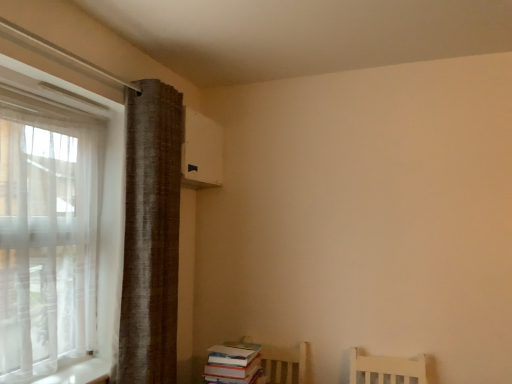
Image resolution: width=512 pixels, height=384 pixels. What are the coordinates of `brown textured curtain at left` in the screenshot? It's located at tap(150, 236).

This screenshot has height=384, width=512. What do you see at coordinates (150, 236) in the screenshot?
I see `brown textured curtain at left` at bounding box center [150, 236].

In order to face brown textured curtain at left, should I rotate leftwards or rightwards?

Rotate your view left by about 13.163°.

Image resolution: width=512 pixels, height=384 pixels. What do you see at coordinates (232, 363) in the screenshot?
I see `hardcover books at lower right` at bounding box center [232, 363].

The image size is (512, 384). Find the location of `hardcover books at lower right`. hardcover books at lower right is located at coordinates (232, 363).

Measure the distance between point (244, 363) and camera.

Point (244, 363) and camera are 1.90 meters apart.

I want to click on brown textured curtain at left, so click(150, 236).

Is brown textured curtain at left to the left of hardcover books at lower right from the viewer's perspective?

Yes, brown textured curtain at left is to the left of hardcover books at lower right.

Which object is further away from the camera taking this photo, brown textured curtain at left or hardcover books at lower right?

hardcover books at lower right.

Which point is more distant from viewer, [172,325] or [215,367]?

Positioned behind is point [172,325].

Looking at this image, from the image's perspective, which is below, brown textured curtain at left or hardcover books at lower right?

hardcover books at lower right.

From a real-world perspective, is brown textured curtain at left positioned under hardcover books at lower right based on gravity?

Incorrect, from a real-world perspective, brown textured curtain at left is higher than hardcover books at lower right.

Which object is thinner, brown textured curtain at left or hardcover books at lower right?

Thinner between the two is brown textured curtain at left.

Is brown textured curtain at left taller or shorter than hardcover books at lower right?

Clearly, brown textured curtain at left is taller compared to hardcover books at lower right.

Considering the sizes of objects brown textured curtain at left and hardcover books at lower right in the image provided, who is bigger, brown textured curtain at left or hardcover books at lower right?

brown textured curtain at left.

Is hardcover books at lower right completely or partially inside brown textured curtain at left?

Actually, hardcover books at lower right is outside brown textured curtain at left.

Is the surface of brown textured curtain at left in direct contact with hardcover books at lower right?

No, brown textured curtain at left is not touching hardcover books at lower right.

Is brown textured curtain at left facing away from hardcover books at lower right?

No, brown textured curtain at left is not facing away from hardcover books at lower right.

Can you tell me how much brown textured curtain at left and hardcover books at lower right differ in facing direction?

They differ by 2.27 degrees in their facing directions.

This screenshot has height=384, width=512. I want to click on curtain lying in front of the hardcover books at lower right, so click(150, 236).

Can you confirm if hardcover books at lower right is positioned to the right of brown textured curtain at left?

Yes.

Is hardcover books at lower right in front of or behind brown textured curtain at left in the image?

In the image, hardcover books at lower right appears behind brown textured curtain at left.

Is point (239, 383) closer to viewer compared to point (135, 374)?

No.

From the image's perspective, is hardcover books at lower right located beneath brown textured curtain at left?

Correct, hardcover books at lower right appears lower than brown textured curtain at left in the image.

From a real-world perspective, which is physically above, hardcover books at lower right or brown textured curtain at left?

brown textured curtain at left.

Can you confirm if hardcover books at lower right is wider than brown textured curtain at left?

Indeed, hardcover books at lower right has a greater width compared to brown textured curtain at left.

Which of these two, hardcover books at lower right or brown textured curtain at left, stands taller?

brown textured curtain at left.

Is hardcover books at lower right smaller than brown textured curtain at left?

Yes.

Based on the photo, would you say hardcover books at lower right is outside brown textured curtain at left?

Yes, hardcover books at lower right is outside of brown textured curtain at left.

Is hardcover books at lower right placed right next to brown textured curtain at left?

There is a gap between hardcover books at lower right and brown textured curtain at left.

Is hardcover books at lower right oriented towards brown textured curtain at left?

No, hardcover books at lower right is not turned towards brown textured curtain at left.

What's the angular difference between hardcover books at lower right and brown textured curtain at left's facing directions?

hardcover books at lower right and brown textured curtain at left are facing 2.27 degrees away from each other.

Find the location of a particular element. book on the right of brown textured curtain at left is located at coordinates (232, 363).

Identify the location of curtain in front of the hardcover books at lower right. The height and width of the screenshot is (384, 512). (150, 236).

At what (x,y) coordinates should I click in order to perform the action: click on book that appears below the brown textured curtain at left (from a real-world perspective). Please return your answer as a coordinate pair (x, y). Looking at the image, I should click on (232, 363).